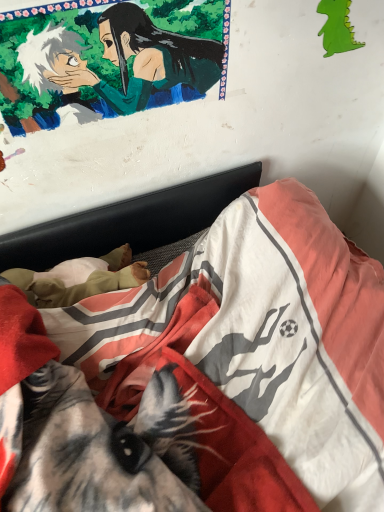
Question: In terms of size, does green paper dragon at upper right appear bigger or smaller than smooth green fabric at upper left?

Choices:
 (A) small
 (B) big

Answer: (A)

Question: Is green paper dragon at upper right wider or thinner than smooth green fabric at upper left?

Choices:
 (A) wide
 (B) thin

Answer: (B)

Question: Which of these objects is positioned farthest from the smooth green fabric at upper left?

Choices:
 (A) soft cotton bed at center
 (B) green paper dragon at upper right

Answer: (A)

Question: Which is farther from the smooth green fabric at upper left?

Choices:
 (A) green paper dragon at upper right
 (B) soft cotton bed at center

Answer: (B)